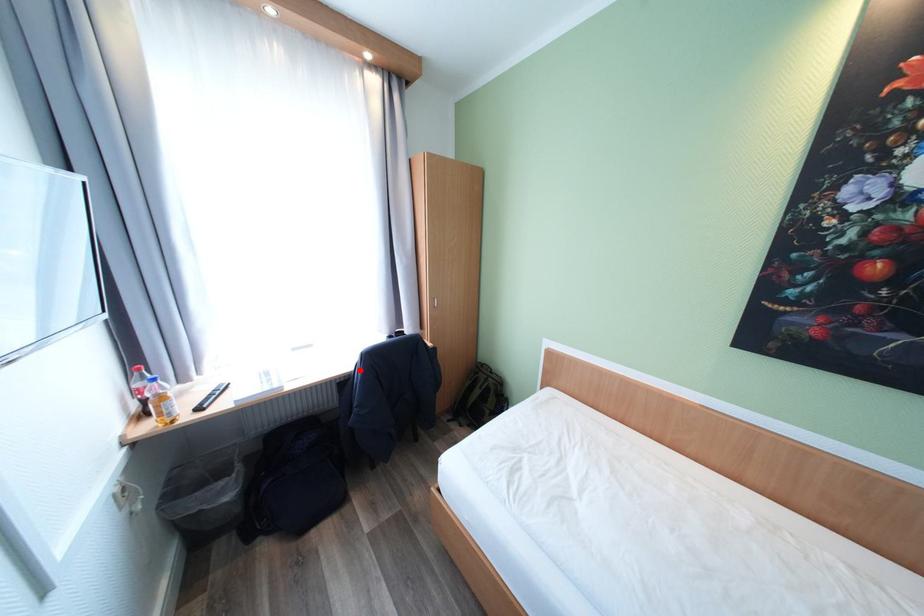
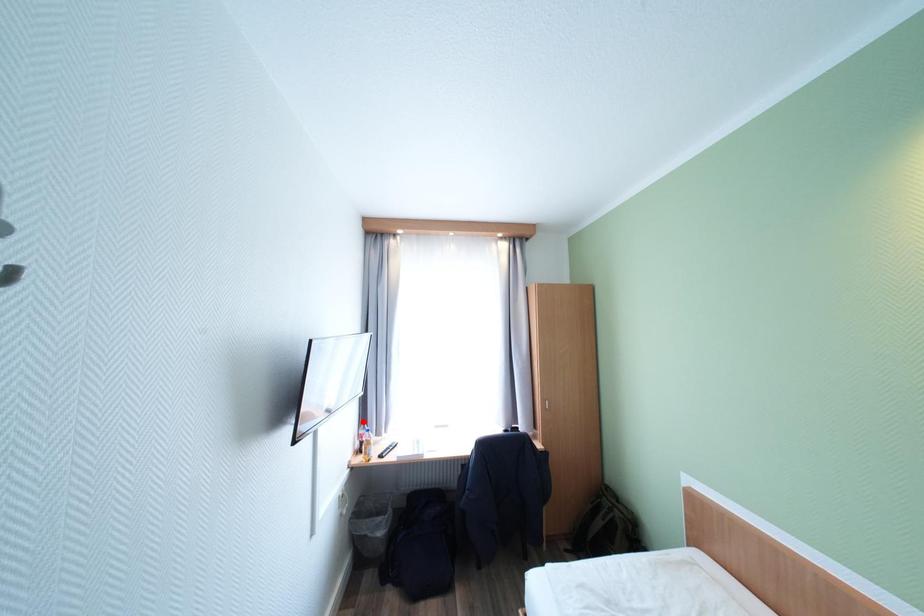
I am providing you with two images of the same scene from different viewpoints. A red point is marked on the first image and another point is marked on the second image. Do the highlighted points in image1 and image2 indicate the same real-world spot?

No